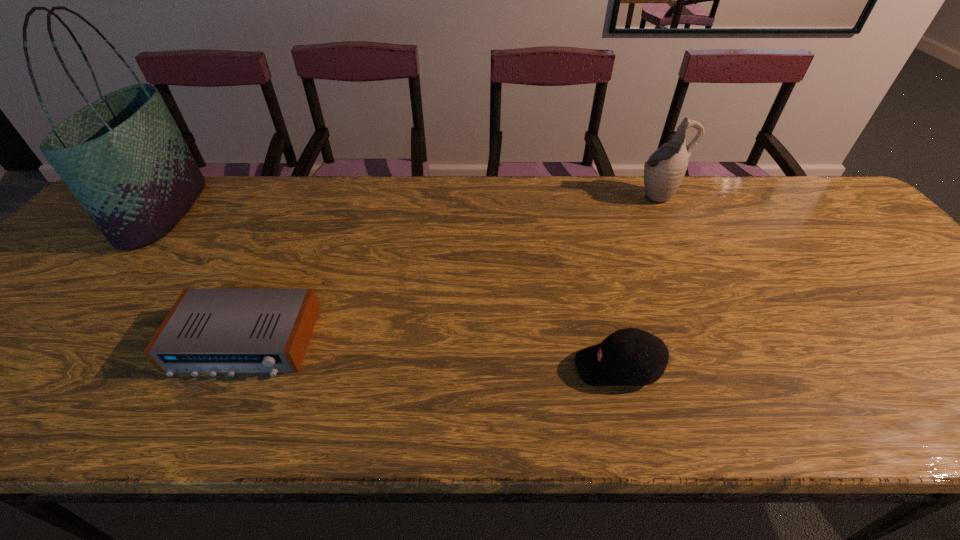
Where is `object that is at the far left corner`? This screenshot has width=960, height=540. object that is at the far left corner is located at coordinates (123, 157).

Where is `vacant region at the far edge of the desktop`? The image size is (960, 540). vacant region at the far edge of the desktop is located at coordinates (651, 200).

Image resolution: width=960 pixels, height=540 pixels. I want to click on vacant space at the near edge, so click(62, 427).

In the image, there is a desktop. Where is `vacant space at the left edge`? Image resolution: width=960 pixels, height=540 pixels. vacant space at the left edge is located at coordinates (73, 287).

Locate an element on the screen. The image size is (960, 540). vacant space at the far right corner of the desktop is located at coordinates (787, 198).

Where is `free space between the shortest object and the baseball cap`? free space between the shortest object and the baseball cap is located at coordinates (431, 354).

Find the location of a particular element. Image resolution: width=960 pixels, height=540 pixels. unoccupied area between the tote bag and the third object from left to right is located at coordinates (391, 289).

You are a GUI agent. You are given a task and a screenshot of the screen. Output one action in this format:
    pyautogui.click(x=<x>, y=<y>)
    Task: Click on the empty location between the tote bag and the second object from left to right
    The height and width of the screenshot is (540, 960).
    Given the screenshot: What is the action you would take?
    pyautogui.click(x=204, y=276)

Where is `free space between the tote bag and the third object from left to right`? This screenshot has height=540, width=960. free space between the tote bag and the third object from left to right is located at coordinates (391, 289).

The height and width of the screenshot is (540, 960). Find the location of `free space between the second shortest object and the tallest object`. free space between the second shortest object and the tallest object is located at coordinates (391, 289).